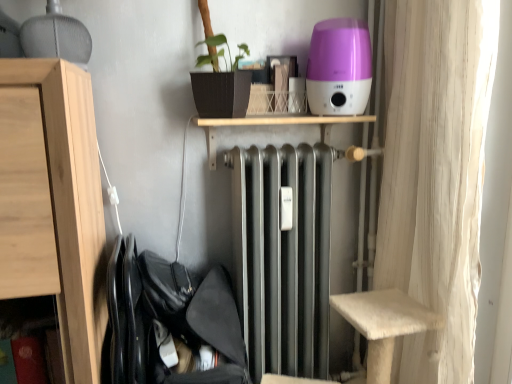
What do you see at coordinates (436, 175) in the screenshot? I see `white textured curtain at right` at bounding box center [436, 175].

This screenshot has height=384, width=512. In order to click on purple glossy humidifier at upper center in this screenshot , I will do `click(339, 67)`.

This screenshot has width=512, height=384. What do you see at coordinates (339, 67) in the screenshot?
I see `purple glossy humidifier at upper center` at bounding box center [339, 67].

Find the location of a particular element. The height and width of the screenshot is (384, 512). black fabric laundry at lower left is located at coordinates (170, 322).

Locate an element on the screen. The image size is (512, 384). light wood cabinet at left is located at coordinates (54, 203).

Find the location of a particular element. This screenshot has height=384, width=512. metallic silver radiator at center is located at coordinates (274, 125).

Measure the distance between black fabric laundry at lower left and light wood cabinet at left.

9.19 inches.

From the image's perspective, is black fabric laundry at lower left above light wood cabinet at left?

No.

Considering the relative sizes of black fabric laundry at lower left and light wood cabinet at left in the image provided, is black fabric laundry at lower left smaller than light wood cabinet at left?

Correct, black fabric laundry at lower left occupies less space than light wood cabinet at left.

Is black fabric laundry at lower left positioned far away from light wood cabinet at left?

Result: They are positioned close to each other.

Who is bigger, light wood cabinet at left or metallic silver radiator at center?

Bigger between the two is light wood cabinet at left.

Which is behind, point (88, 119) or point (212, 151)?

Point (212, 151)

From a real-world perspective, is light wood cabinet at left below metallic silver radiator at center?

Indeed, from a real-world perspective, light wood cabinet at left is positioned beneath metallic silver radiator at center.

The height and width of the screenshot is (384, 512). Identify the location of furniture that is under the metallic silver radiator at center (from a real-world perspective). (54, 203).

Can you confirm if metallic silver radiator at center is bigger than white textured curtain at right?

No.

Would you say metallic silver radiator at center is a long distance from white textured curtain at right?

Actually, metallic silver radiator at center and white textured curtain at right are a little close together.

Which point is more forward, (x=200, y=126) or (x=418, y=202)?

The point (x=418, y=202) is more forward.

At what (x,y) coordinates should I click in order to perform the action: click on curtain directly beneath the metallic silver radiator at center (from a real-world perspective). Please return your answer as a coordinate pair (x, y). The image size is (512, 384). Looking at the image, I should click on (436, 175).

From a real-world perspective, relative to black fabric laundry at lower left, is metallic silver radiator at center vertically above or below?

From a real-world perspective, metallic silver radiator at center is physically above black fabric laundry at lower left.

Between metallic silver radiator at center and black fabric laundry at lower left, which one appears on the right side from the viewer's perspective?

From the viewer's perspective, metallic silver radiator at center appears more on the right side.

The image size is (512, 384). What are the coordinates of `shelf that appears above the black fabric laundry at lower left (from a real-world perspective)` in the screenshot? It's located at (274, 125).

Is purple glossy humidifier at upper center taller or shorter than metallic silver radiator at center?

In the image, purple glossy humidifier at upper center appears to be taller than metallic silver radiator at center.

Considering the points (353, 96) and (367, 116), which point is behind, point (353, 96) or point (367, 116)?

The point (367, 116) is farther from the camera.

Considering the relative sizes of purple glossy humidifier at upper center and metallic silver radiator at center in the image provided, is purple glossy humidifier at upper center thinner than metallic silver radiator at center?

Indeed, purple glossy humidifier at upper center has a lesser width compared to metallic silver radiator at center.

From the image's perspective, between purple glossy humidifier at upper center and metallic silver radiator at center, who is located below?

metallic silver radiator at center.

Is white textured curtain at right positioned behind metallic silver radiator at center?

No, white textured curtain at right is in front of metallic silver radiator at center.

From the image's perspective, which one is positioned lower, white textured curtain at right or metallic silver radiator at center?

From the image's view, white textured curtain at right is below.

From a real-world perspective, is white textured curtain at right located beneath metallic silver radiator at center?

Yes.

Are white textured curtain at right and metallic silver radiator at center making contact?

white textured curtain at right and metallic silver radiator at center are clearly separated.

Considering the relative positions of purple glossy humidifier at upper center and black fabric laundry at lower left in the image provided, is purple glossy humidifier at upper center to the left of black fabric laundry at lower left from the viewer's perspective?

Incorrect, purple glossy humidifier at upper center is not on the left side of black fabric laundry at lower left.

Measure the distance from purple glossy humidifier at upper center to black fabric laundry at lower left.

A distance of 32.22 inches exists between purple glossy humidifier at upper center and black fabric laundry at lower left.

Between purple glossy humidifier at upper center and black fabric laundry at lower left, which one has smaller size?

purple glossy humidifier at upper center is smaller.

From the picture: Is purple glossy humidifier at upper center positioned with its back to black fabric laundry at lower left?

No, purple glossy humidifier at upper center's orientation is not away from black fabric laundry at lower left.

You are a GUI agent. You are given a task and a screenshot of the screen. Output one action in this format:
    pyautogui.click(x=<x>, y=<y>)
    Task: Click on the furniture that is above the black fabric laundry at lower left (from the image's perspective)
    The width and height of the screenshot is (512, 384).
    Given the screenshot: What is the action you would take?
    pyautogui.click(x=54, y=203)

Find the location of a particular element. shelf that appears above the light wood cabinet at left (from a real-world perspective) is located at coordinates (274, 125).

From the image, which object appears to be nearer to white textured curtain at right, light wood cabinet at left or purple glossy humidifier at upper center?

purple glossy humidifier at upper center is positioned closer to the anchor white textured curtain at right.

Based on their spatial positions, is white textured curtain at right or light wood cabinet at left closer to metallic silver radiator at center?

white textured curtain at right.

In the scene shown: Based on their spatial positions, is metallic silver radiator at center or white textured curtain at right closer to black fabric laundry at lower left?

metallic silver radiator at center lies closer to black fabric laundry at lower left than the other object.

Looking at the image, which one is located further to white textured curtain at right, light wood cabinet at left or metallic silver radiator at center?

light wood cabinet at left.

Based on the photo, which object lies nearer to the anchor point white textured curtain at right, metallic silver radiator at center or black fabric laundry at lower left?

metallic silver radiator at center is positioned closer to the anchor white textured curtain at right.

Which object lies further to the anchor point black fabric laundry at lower left, light wood cabinet at left or purple glossy humidifier at upper center?

purple glossy humidifier at upper center is positioned further to the anchor black fabric laundry at lower left.

From the image, which object appears to be nearer to metallic silver radiator at center, white textured curtain at right or black fabric laundry at lower left?

white textured curtain at right.

Looking at the image, which one is located further to purple glossy humidifier at upper center, metallic silver radiator at center or light wood cabinet at left?

light wood cabinet at left is further to purple glossy humidifier at upper center.

The image size is (512, 384). I want to click on shelf that lies between purple glossy humidifier at upper center and white textured curtain at right from top to bottom, so click(274, 125).

Image resolution: width=512 pixels, height=384 pixels. I want to click on curtain that lies between purple glossy humidifier at upper center and black fabric laundry at lower left from top to bottom, so click(x=436, y=175).

Where is `shelf between light wood cabinet at left and white textured curtain at right in the horizontal direction`? This screenshot has width=512, height=384. shelf between light wood cabinet at left and white textured curtain at right in the horizontal direction is located at coordinates (274, 125).

Locate an element on the screen. shelf between purple glossy humidifier at upper center and black fabric laundry at lower left vertically is located at coordinates [274, 125].